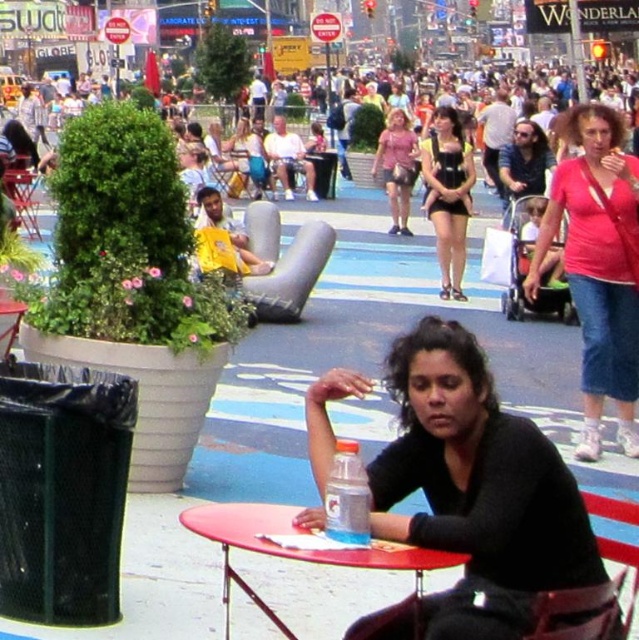
Question: Which is farther from the yellow fabric baby carrier at center?

Choices:
 (A) pink fabric shirt at upper right
 (B) metallic silver chair at left
 (C) smooth plastic table at center

Answer: (C)

Question: Does black matte shirt at center have a smaller size compared to metallic silver chair at center?

Choices:
 (A) yes
 (B) no

Answer: (B)

Question: Does metallic silver chair at left appear on the left side of metallic silver chair at center?

Choices:
 (A) no
 (B) yes

Answer: (B)

Question: Where is matte pink dress at center located in relation to metallic silver chair at left in the image?

Choices:
 (A) below
 (B) above

Answer: (B)

Question: Which point is closer to the camera?

Choices:
 (A) (555, 570)
 (B) (4, 176)
 (C) (454, 556)

Answer: (C)

Question: Based on their relative distances, which object is farther from the metallic silver chair at center?

Choices:
 (A) black matte shirt at center
 (B) pink fabric shirt at upper right
 (C) yellow fabric baby carrier at center

Answer: (A)